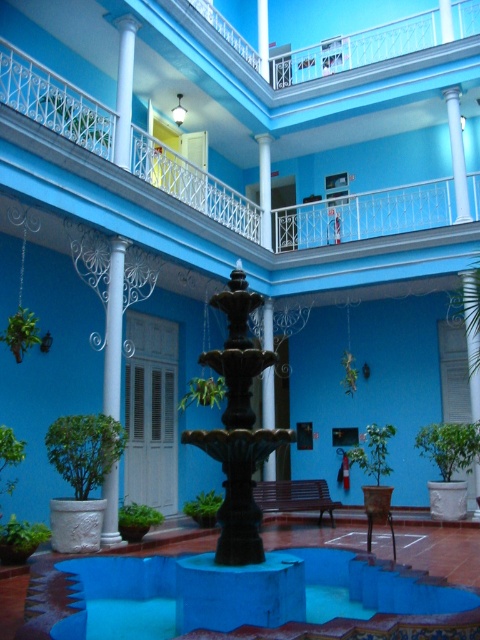
Does white glossy column at upper center have a lesser width compared to black polished pillar at center?

No.

Can you confirm if white glossy column at upper center is taller than black polished pillar at center?

Correct, white glossy column at upper center is much taller as black polished pillar at center.

The height and width of the screenshot is (640, 480). Describe the element at coordinates (456, 154) in the screenshot. I see `white glossy column at upper center` at that location.

Where is `white glossy column at upper center`? white glossy column at upper center is located at coordinates (456, 154).

Can you confirm if blue concrete fountain at center is positioned to the right of black polished pillar at center?

Indeed, blue concrete fountain at center is positioned on the right side of black polished pillar at center.

Is point (75, 566) positioned after point (265, 420)?

No, it is not.

Image resolution: width=480 pixels, height=640 pixels. I want to click on blue concrete fountain at center, so click(x=372, y=588).

Can you confirm if white marble column at center is bigger than white glossy column at upper center?

Correct, white marble column at center is larger in size than white glossy column at upper center.

Is white marble column at center above white glossy column at upper center?

Indeed, white marble column at center is positioned over white glossy column at upper center.

Is point (128, 160) closer to camera compared to point (451, 88)?

Yes, point (128, 160) is closer to viewer.

The width and height of the screenshot is (480, 640). In order to click on white marble column at center in this screenshot , I will do `click(123, 90)`.